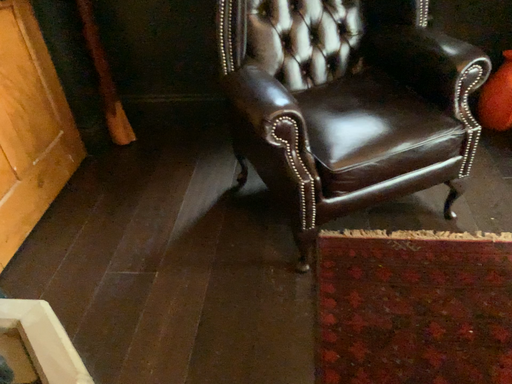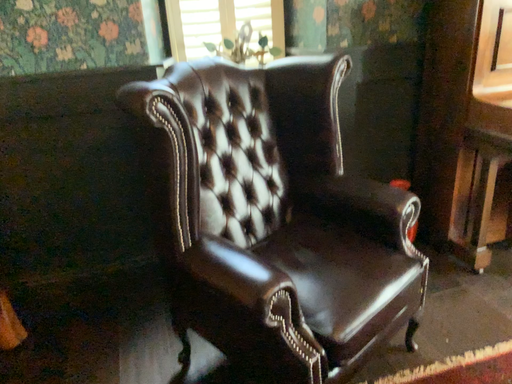
Question: Which way did the camera rotate in the video?

Choices:
 (A) rotated right
 (B) rotated left

Answer: (A)